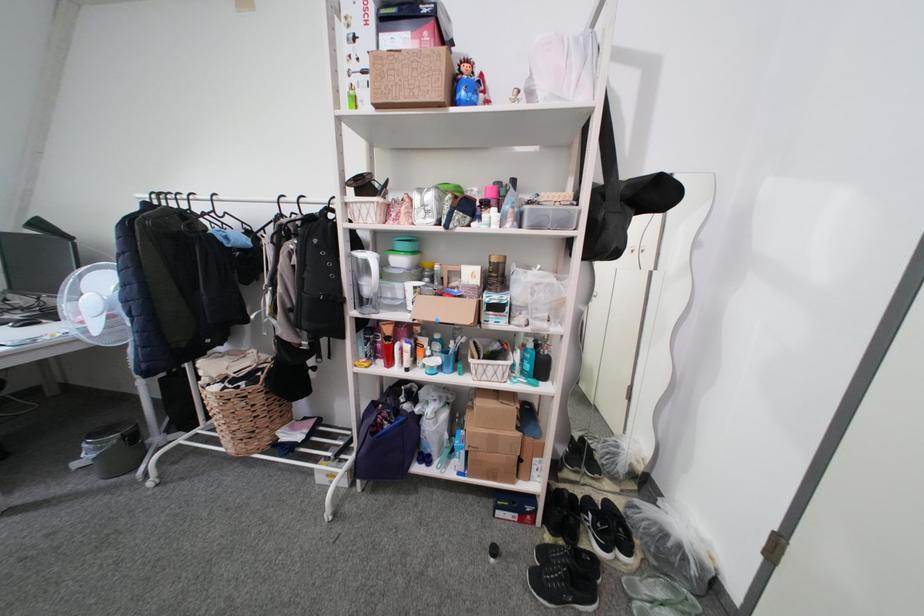
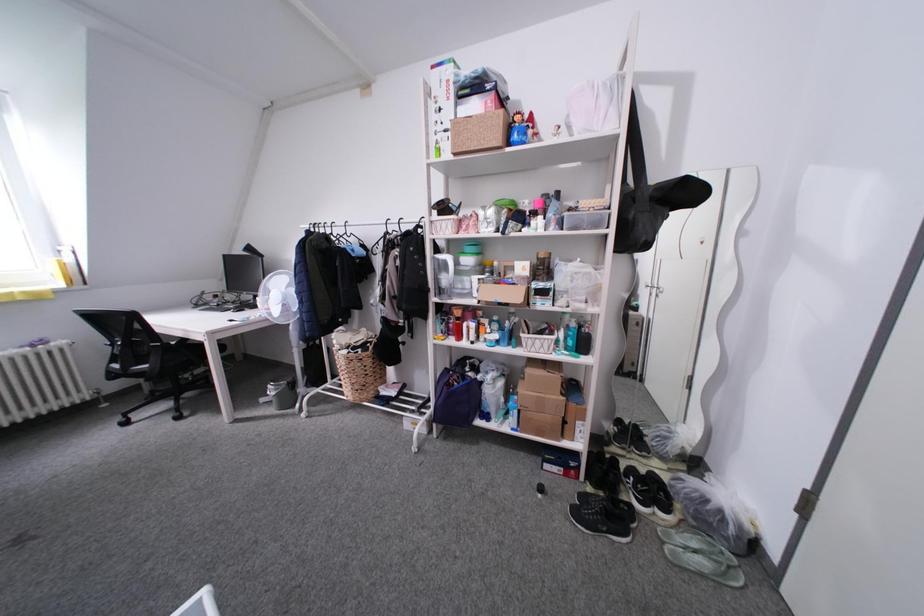
Question: The images are taken continuously from a first-person perspective. In which direction are you moving?

Choices:
 (A) Left
 (B) Right
 (C) Forward
 (D) Backward

Answer: (D)